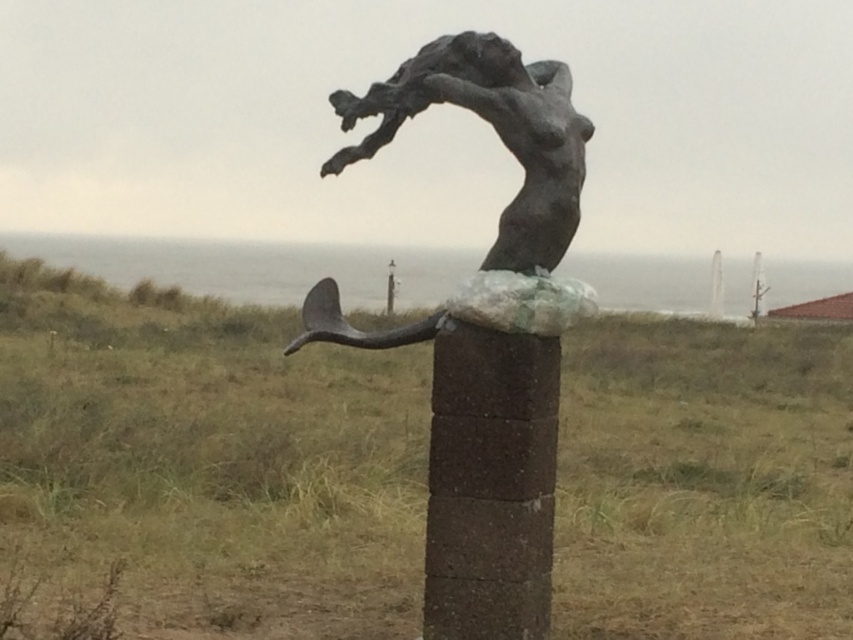
From the picture: You are an art student trying to sketch the sculpture. You notice two objects at the center of the scene. Which one is positioned lower between the brown stone pole at center and the bronze sculpture at center?

The brown stone pole at center is located below the bronze sculpture at center, so it is positioned lower.

You are an artist planning to paint the sculpture scene. You need to decide which object to focus on first based on their sizes. Which object should you paint first, the brown stone pole at center or the bronze mermaid at center?

The bronze mermaid at center is larger than the brown stone pole at center, so you should paint the bronze mermaid at center first since it occupies more space in the scene.

You are standing in front of the sculpture and want to take a photo of the brown stone pole at center and the bronze mermaid at center. Which object will appear larger in your photo?

→ The brown stone pole at center will appear larger in the photo because it is closer to the viewer than the bronze mermaid at center.